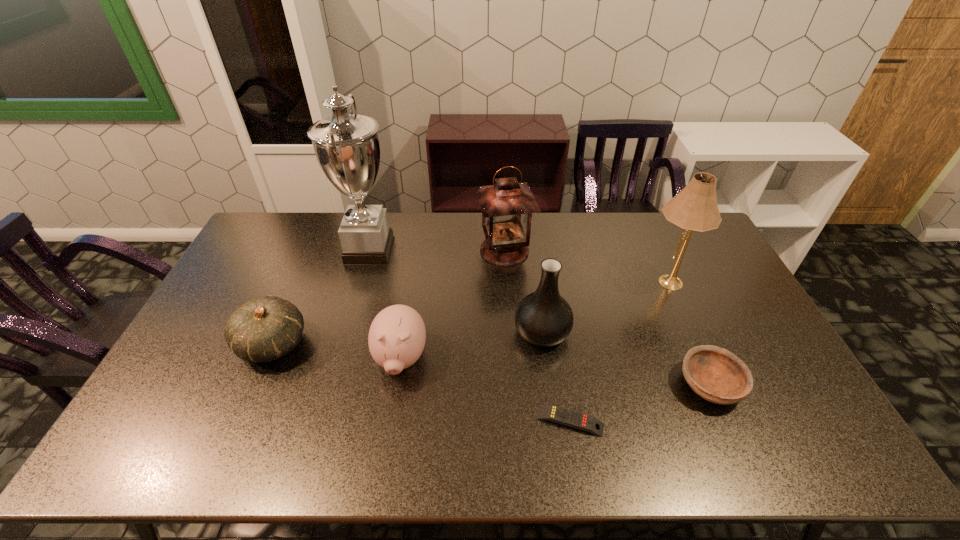
The width and height of the screenshot is (960, 540). In order to click on free space between the lampshade and the shortest object in this screenshot , I will do `click(617, 352)`.

The image size is (960, 540). Identify the location of vacant area that lies between the bowl and the remote control. (639, 403).

Where is `vacant space that's between the lampshade and the trophy cup`? vacant space that's between the lampshade and the trophy cup is located at coordinates (517, 267).

Find the location of `vacant area between the bowl and the shortest object`. vacant area between the bowl and the shortest object is located at coordinates (639, 403).

Where is `vacant space that's between the fifth shortest object and the trophy cup`? This screenshot has height=540, width=960. vacant space that's between the fifth shortest object and the trophy cup is located at coordinates (456, 291).

Find the location of `vacant area between the remote control and the gourd`. vacant area between the remote control and the gourd is located at coordinates (421, 383).

Identify the location of object that ranks as the second closest to the seventh tallest object. (694, 208).

Locate an element on the screen. The image size is (960, 540). object that is the third closest to the gourd is located at coordinates (507, 206).

The height and width of the screenshot is (540, 960). Identify the location of free location that satisfies the following two spatial constraints: 1. at the front view of the remote control; 2. on the right side of the tallest object. (321, 421).

Locate an element on the screen. free space that satisfies the following two spatial constraints: 1. on the back side of the oil lamp; 2. on the right side of the gourd is located at coordinates (313, 251).